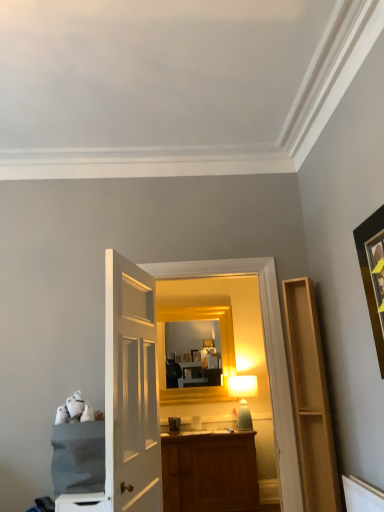
Question: Does black matte picture frame at upper right have a lesser width compared to denim fabric cabinet at left, the first cabinetry when ordered from left to right?

Choices:
 (A) no
 (B) yes

Answer: (B)

Question: From the image's perspective, is black matte picture frame at upper right on top of denim fabric cabinet at left, the first cabinetry when ordered from left to right?

Choices:
 (A) no
 (B) yes

Answer: (B)

Question: Considering the relative sizes of black matte picture frame at upper right and denim fabric cabinet at left, the first cabinetry when ordered from left to right, in the image provided, is black matte picture frame at upper right wider than denim fabric cabinet at left, the first cabinetry when ordered from left to right,?

Choices:
 (A) no
 (B) yes

Answer: (A)

Question: Is black matte picture frame at upper right closer to camera compared to denim fabric cabinet at left, the first cabinetry when ordered from left to right?

Choices:
 (A) no
 (B) yes

Answer: (B)

Question: From a real-world perspective, is black matte picture frame at upper right on denim fabric cabinet at left, the second cabinetry when ordered from right to left?

Choices:
 (A) yes
 (B) no

Answer: (A)

Question: In terms of size, does denim fabric cabinet at left, the first cabinetry when ordered from left to right, appear bigger or smaller than matte white table lamp at center?

Choices:
 (A) small
 (B) big

Answer: (B)

Question: Considering the positions of point (77, 478) and point (243, 380), is point (77, 478) closer or farther from the camera than point (243, 380)?

Choices:
 (A) closer
 (B) farther

Answer: (A)

Question: Considering the positions of denim fabric cabinet at left, the second cabinetry when ordered from right to left, and matte white table lamp at center in the image, is denim fabric cabinet at left, the second cabinetry when ordered from right to left, taller or shorter than matte white table lamp at center?

Choices:
 (A) short
 (B) tall

Answer: (A)

Question: From the image's perspective, is denim fabric cabinet at left, the first cabinetry when ordered from left to right, positioned above or below matte white table lamp at center?

Choices:
 (A) below
 (B) above

Answer: (B)

Question: Is denim fabric cabinet at left, the second cabinetry when ordered from right to left, spatially inside black matte picture frame at upper right, or outside of it?

Choices:
 (A) outside
 (B) inside

Answer: (A)

Question: Would you say denim fabric cabinet at left, the second cabinetry when ordered from right to left, is to the left or to the right of black matte picture frame at upper right in the picture?

Choices:
 (A) left
 (B) right

Answer: (A)

Question: From the image's perspective, is denim fabric cabinet at left, the first cabinetry when ordered from left to right, located above or below black matte picture frame at upper right?

Choices:
 (A) below
 (B) above

Answer: (A)

Question: In terms of size, does denim fabric cabinet at left, the second cabinetry when ordered from right to left, appear bigger or smaller than black matte picture frame at upper right?

Choices:
 (A) small
 (B) big

Answer: (B)

Question: Considering the positions of matte white table lamp at center and light wood shelf at right, acting as the 2th cabinetry starting from the left, in the image, is matte white table lamp at center bigger or smaller than light wood shelf at right, acting as the 2th cabinetry starting from the left,?

Choices:
 (A) small
 (B) big

Answer: (A)

Question: In terms of width, does matte white table lamp at center look wider or thinner when compared to light wood shelf at right, acting as the 2th cabinetry starting from the left?

Choices:
 (A) wide
 (B) thin

Answer: (A)